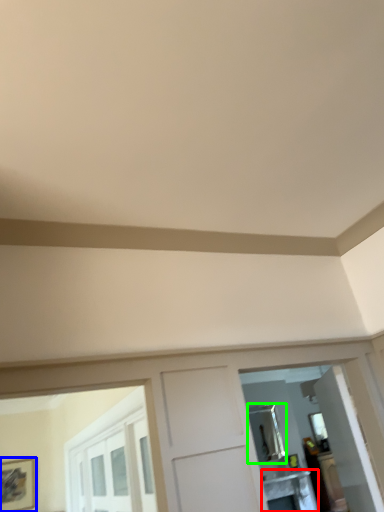
Question: Estimate the real-world distances between objects in this image. Which object is closer to table (highlighted by a red box), picture frame (highlighted by a blue box) or mirror (highlighted by a green box)?

Choices:
 (A) picture frame
 (B) mirror

Answer: (B)